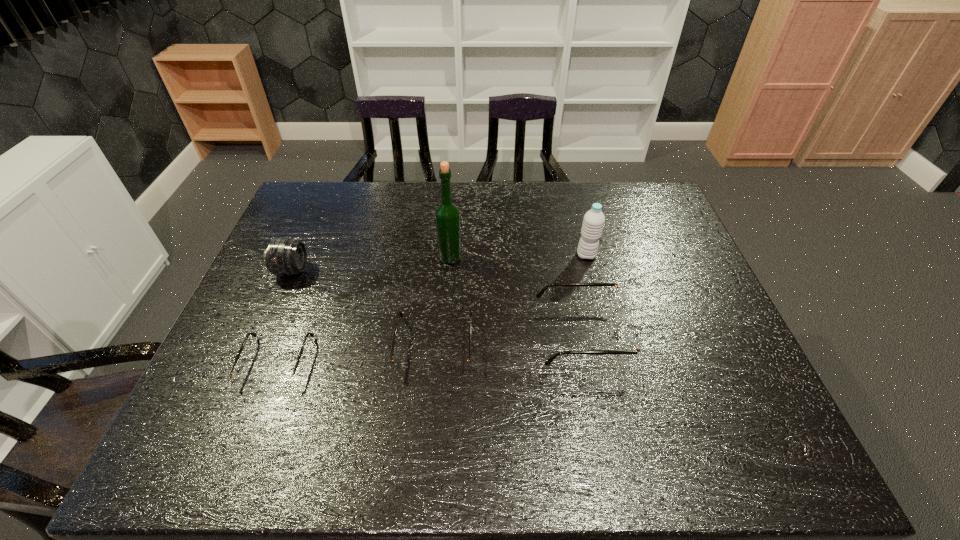
Locate an element on the screen. The height and width of the screenshot is (540, 960). free space between the water bottle and the leftmost spectacles is located at coordinates (431, 309).

You are a GUI agent. You are given a task and a screenshot of the screen. Output one action in this format:
    pyautogui.click(x=<x>, y=<y>)
    Task: Click on the vacant point located between the third tallest object and the second spectacles from left to right
    This screenshot has width=960, height=540.
    Given the screenshot: What is the action you would take?
    (x=363, y=309)

At what (x,y) coordinates should I click in order to perform the action: click on vacant space that is in between the shortest spectacles and the second shortest object. Please return your answer as a coordinate pair (x, y). This screenshot has width=960, height=540. Looking at the image, I should click on (355, 354).

Identify which object is located as the fourth nearest to the second spectacles from left to right. Please provide its 2D coordinates. Your answer should be formatted as a tuple, i.e. [(x, y)], where the tuple contains the x and y coordinates of a point satisfying the conditions above.

[(284, 256)]

Select which object appears as the third closest to the telephoto lens. Please provide its 2D coordinates. Your answer should be formatted as a tuple, i.e. [(x, y)], where the tuple contains the x and y coordinates of a point satisfying the conditions above.

[(447, 214)]

Where is `the closest spectacles to the rightmost spectacles`? the closest spectacles to the rightmost spectacles is located at coordinates (402, 367).

Locate an element on the screen. spectacles that stands as the second closest to the liquor is located at coordinates (632, 344).